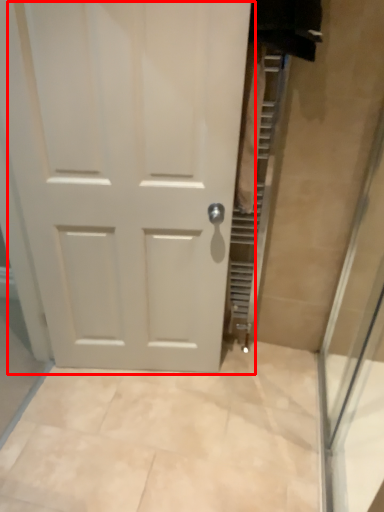
Question: From the image's perspective, what is the correct spatial relationship of door (annotated by the red box) in relation to shower door?

Choices:
 (A) above
 (B) below

Answer: (A)